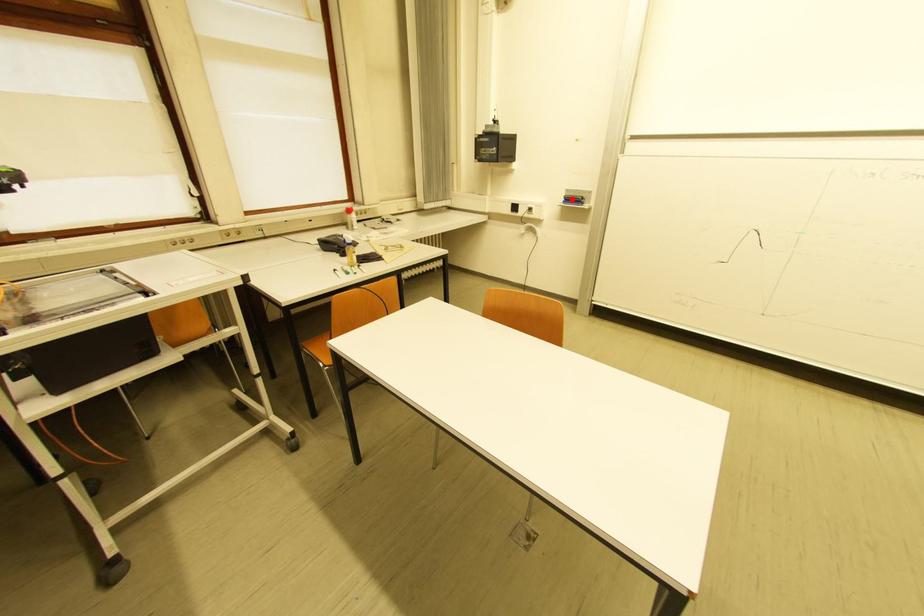
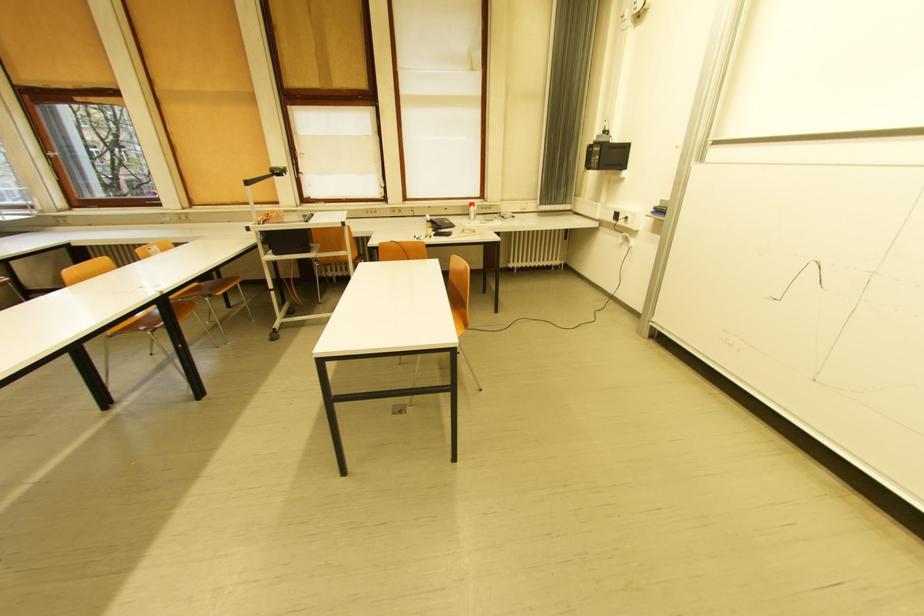
Find the pixel in the second image that matches the highlighted location in the first image.

(662, 209)